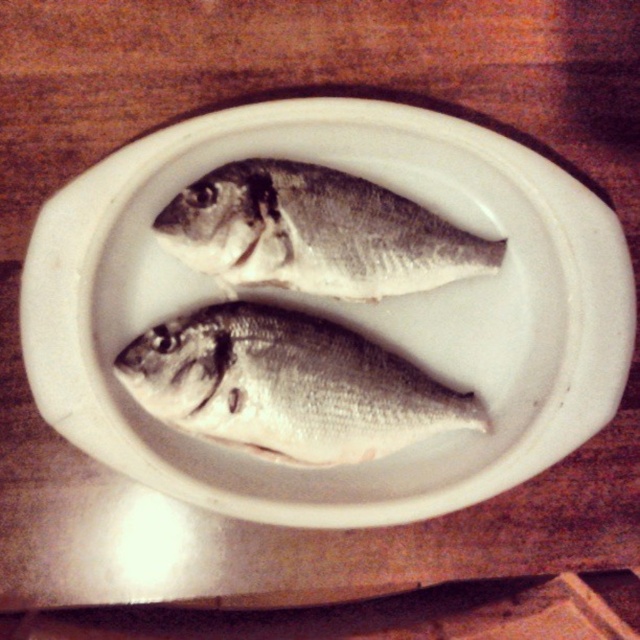
You are a chef preparing to arrange two shiny silver fish at center on a white ceramic plate at center for a presentation. The fish are currently placed side by side on the plate. The customer has requested that the fish be spaced exactly 3 inches apart for aesthetic purposes. Based on the current arrangement, will the spacing between the fish meet the customer requirement?

The distance between the white ceramic plate at center and the shiny silver fish at center is 3.48 inches, which is slightly more than the required 3 inches. Therefore, the spacing between the fish currently exceeds the customer requirement by 0.48 inches.

You are a chef preparing to plate a dish and need to place a garnish exactly at the point marked by coordinates point (x=288, y=385). Given the scene described, where will this garnish be placed relative to the shiny silver fish at center?

The point (x=288, y=385) corresponds to the shiny silver fish at center, so the garnish will be placed directly on the shiny silver fish at center.